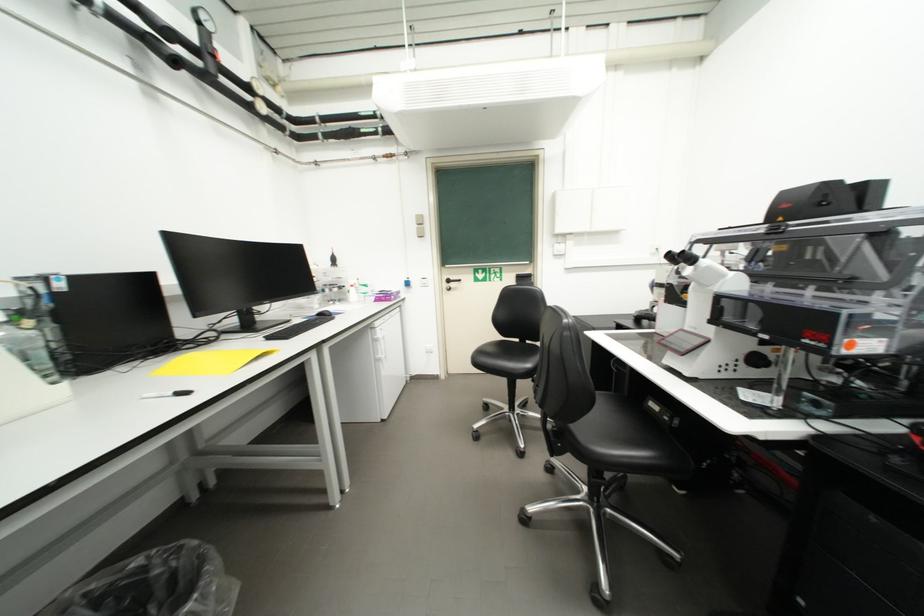
Where is `black door handle`? black door handle is located at coordinates (451, 282).